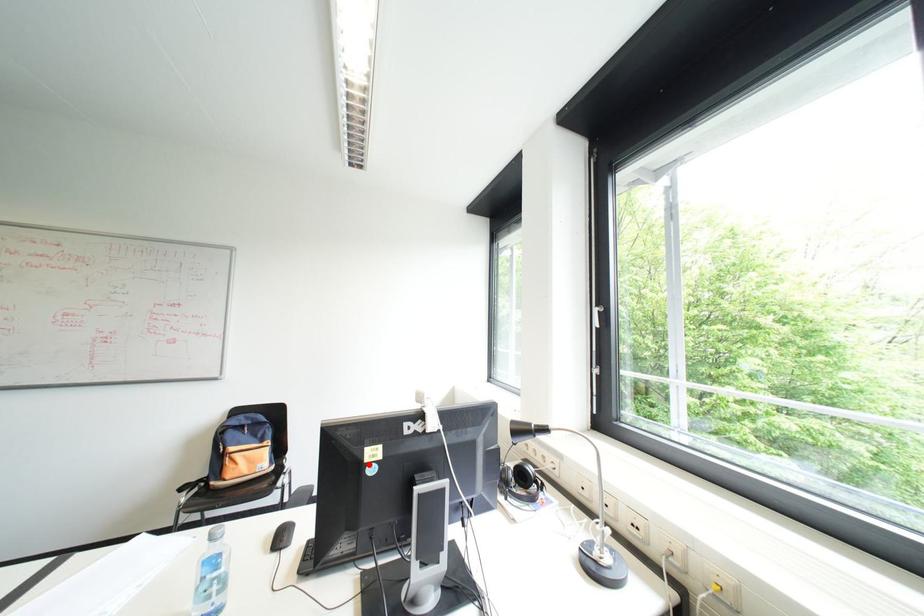
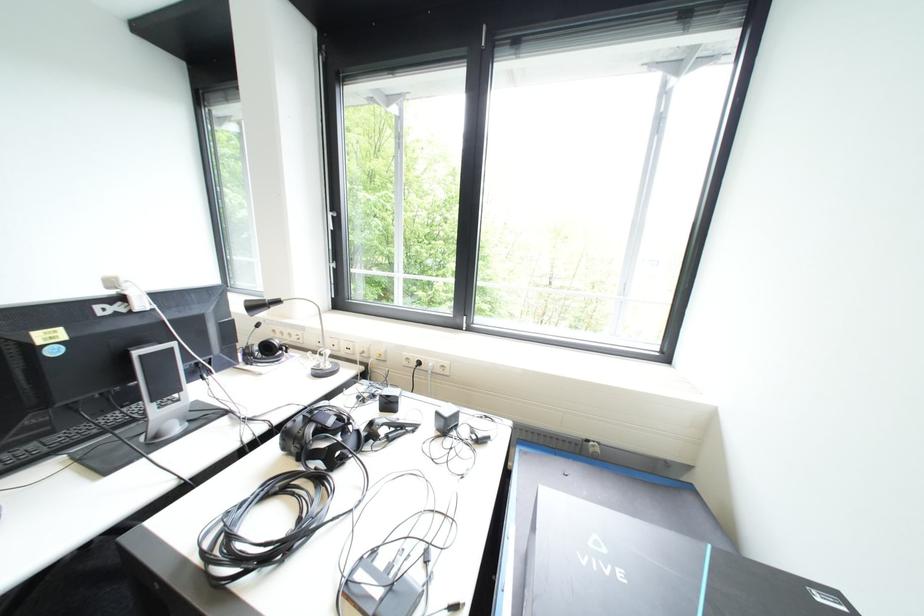
In the second image, find the point that corresponds to the highlighted location in the first image.

(40, 347)